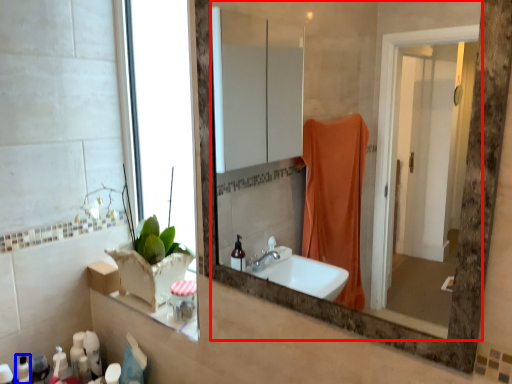
Question: Which object appears farthest to the camera in this image, mirror (highlighted by a red box) or toiletry (highlighted by a blue box)?

Choices:
 (A) mirror
 (B) toiletry

Answer: (B)